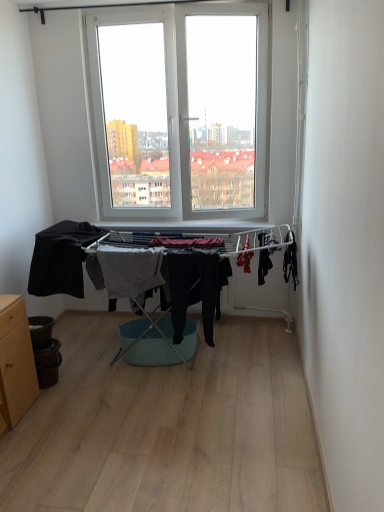
Question: Considering the relative sizes of black matte fabric at left, the 4th clothing when ordered from right to left, and wooden cabinet at lower left in the image provided, is black matte fabric at left, the 4th clothing when ordered from right to left, bigger than wooden cabinet at lower left?

Choices:
 (A) yes
 (B) no

Answer: (A)

Question: Is black matte fabric at left, the 4th clothing when ordered from right to left, turned away from wooden cabinet at lower left?

Choices:
 (A) yes
 (B) no

Answer: (B)

Question: From the image's perspective, is black matte fabric at left, acting as the 1th clothing starting from the left, under wooden cabinet at lower left?

Choices:
 (A) no
 (B) yes

Answer: (A)

Question: Is black matte fabric at left, acting as the 1th clothing starting from the left, further to the viewer compared to wooden cabinet at lower left?

Choices:
 (A) yes
 (B) no

Answer: (A)

Question: Is black matte fabric at left, the 4th clothing when ordered from right to left, not near wooden cabinet at lower left?

Choices:
 (A) no
 (B) yes

Answer: (A)

Question: Considering the positions of wooden cabinet at lower left and black matte clothing at right, the first clothing in the right-to-left sequence, in the image, is wooden cabinet at lower left bigger or smaller than black matte clothing at right, the first clothing in the right-to-left sequence,?

Choices:
 (A) big
 (B) small

Answer: (A)

Question: Is wooden cabinet at lower left wider or thinner than black matte clothing at right, the first clothing in the right-to-left sequence?

Choices:
 (A) wide
 (B) thin

Answer: (A)

Question: Choose the correct answer: Is wooden cabinet at lower left inside black matte clothing at right, the first clothing in the right-to-left sequence, or outside it?

Choices:
 (A) inside
 (B) outside

Answer: (B)

Question: From their relative heights in the image, would you say wooden cabinet at lower left is taller or shorter than black matte clothing at right, the first clothing in the right-to-left sequence?

Choices:
 (A) short
 (B) tall

Answer: (B)

Question: Would you say black matte pants at center, which appears as the third clothing when viewed from the left, is inside or outside gray cotton towel at center, which appears as the third clothing when viewed from the right?

Choices:
 (A) inside
 (B) outside

Answer: (B)

Question: Considering the positions of black matte pants at center, the second clothing from the right, and gray cotton towel at center, which is counted as the second clothing, starting from the left, in the image, is black matte pants at center, the second clothing from the right, wider or thinner than gray cotton towel at center, which is counted as the second clothing, starting from the left,?

Choices:
 (A) wide
 (B) thin

Answer: (B)

Question: In terms of size, does black matte pants at center, the second clothing from the right, appear bigger or smaller than gray cotton towel at center, which appears as the third clothing when viewed from the right?

Choices:
 (A) small
 (B) big

Answer: (A)

Question: Relative to gray cotton towel at center, which is counted as the second clothing, starting from the left, is black matte pants at center, which appears as the third clothing when viewed from the left, in front or behind?

Choices:
 (A) front
 (B) behind

Answer: (A)

Question: Is wooden cabinet at lower left taller or shorter than black matte pants at center, the second clothing from the right?

Choices:
 (A) tall
 (B) short

Answer: (A)

Question: Is wooden cabinet at lower left in front of or behind black matte pants at center, the second clothing from the right, in the image?

Choices:
 (A) front
 (B) behind

Answer: (A)